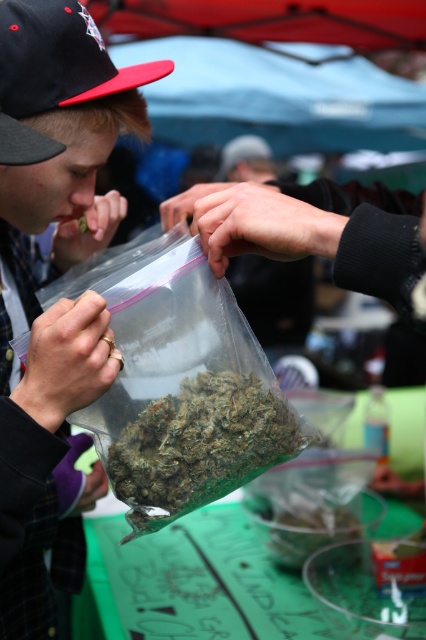
Is green matte marijuana at center to the left of black fabric baseball cap at upper left from the viewer's perspective?

In fact, green matte marijuana at center is to the right of black fabric baseball cap at upper left.

Is point (239, 467) behind point (97, 56)?

That is False.

Identify the location of green matte marijuana at center. The height and width of the screenshot is (640, 426). 199,444.